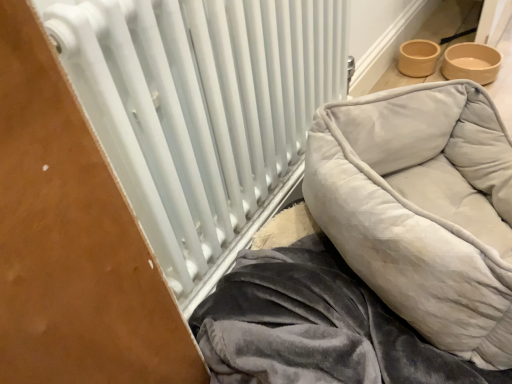
Question: Is point (462, 180) closer or farther from the camera than point (241, 241)?

Choices:
 (A) farther
 (B) closer

Answer: (B)

Question: In terms of width, does velvet gray pet bed at right look wider or thinner when compared to white metallic radiator at center?

Choices:
 (A) thin
 (B) wide

Answer: (B)

Question: From their relative heights in the image, would you say velvet gray pet bed at right is taller or shorter than white metallic radiator at center?

Choices:
 (A) short
 (B) tall

Answer: (A)

Question: Would you say white metallic radiator at center is to the left or to the right of velvet gray pet bed at right in the picture?

Choices:
 (A) right
 (B) left

Answer: (B)

Question: Which is correct: white metallic radiator at center is inside velvet gray pet bed at right, or outside of it?

Choices:
 (A) inside
 (B) outside

Answer: (B)

Question: From the image's perspective, relative to velvet gray pet bed at right, is white metallic radiator at center above or below?

Choices:
 (A) below
 (B) above

Answer: (B)

Question: Is point (334, 18) positioned closer to the camera than point (467, 110)?

Choices:
 (A) farther
 (B) closer

Answer: (A)